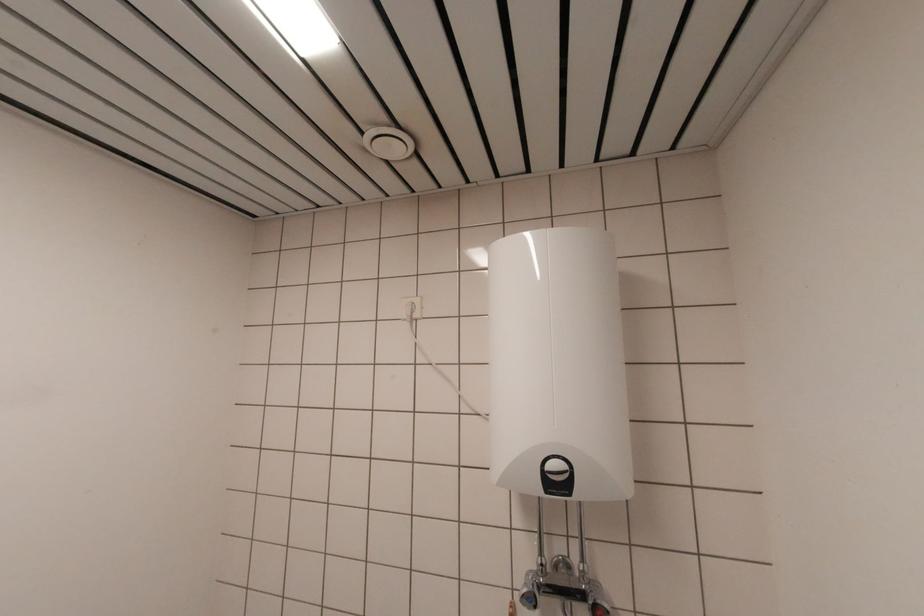
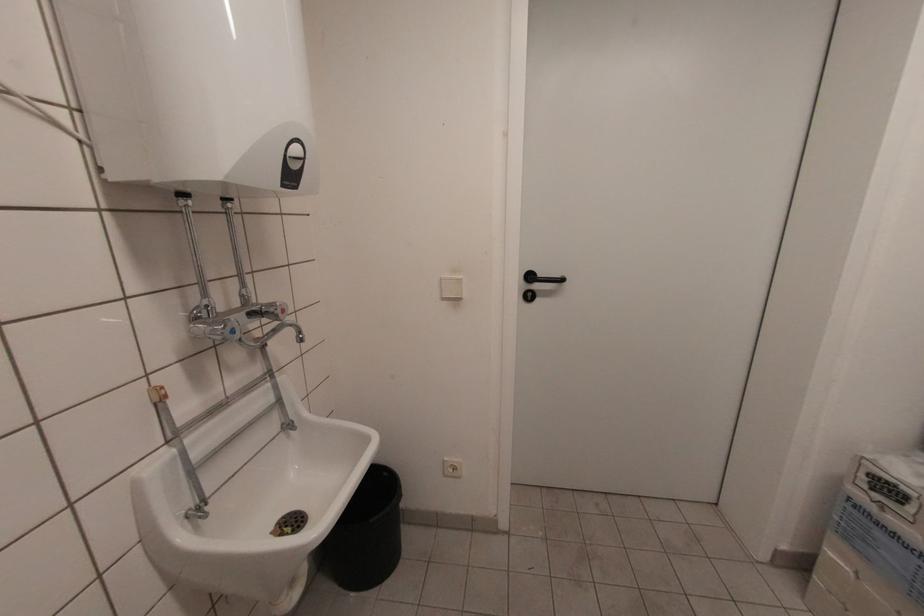
Question: The images are taken continuously from a first-person perspective. In which direction is your viewpoint rotating?

Choices:
 (A) Left
 (B) Right
 (C) Up
 (D) Down

Answer: (B)